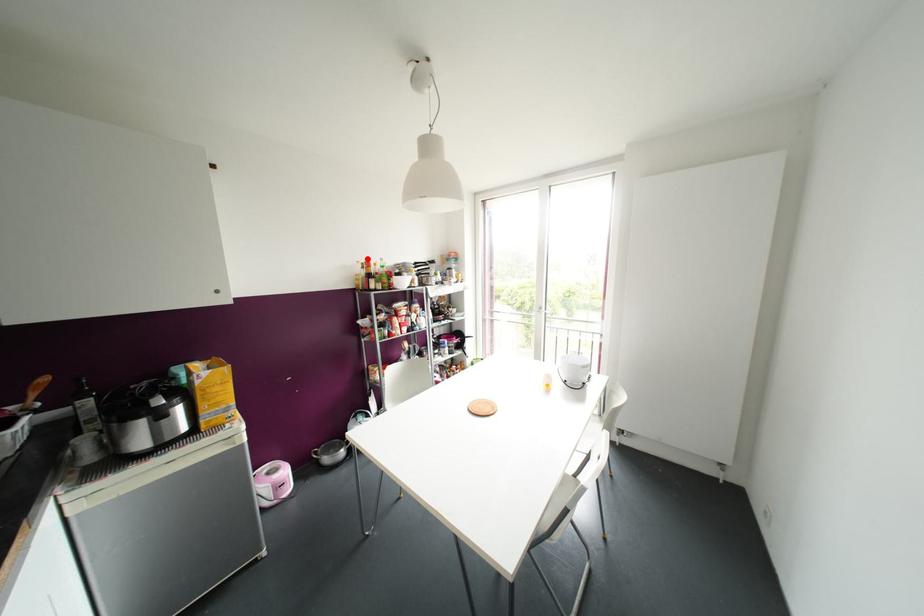
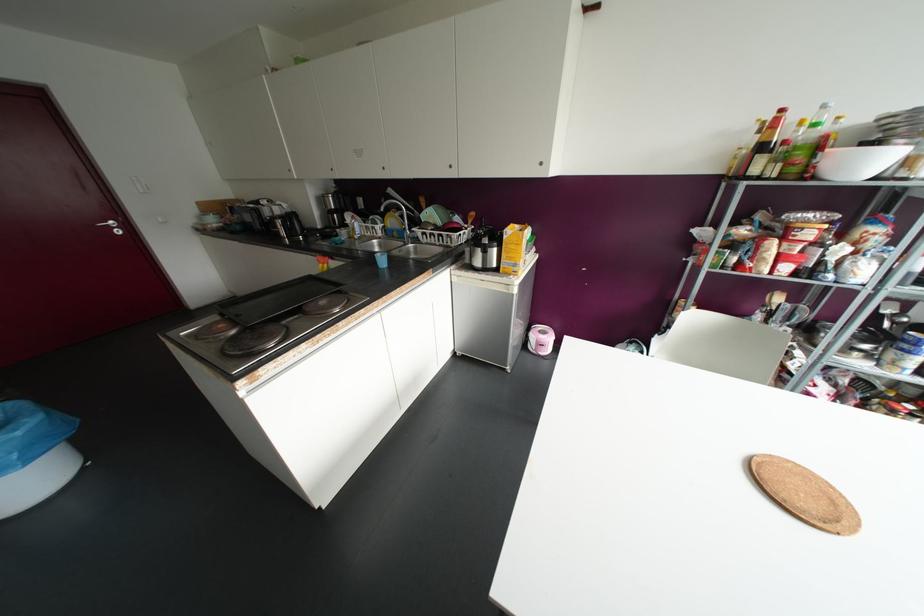
Locate, in the second image, the point that corresponds to the highlighted location in the first image.

(781, 110)